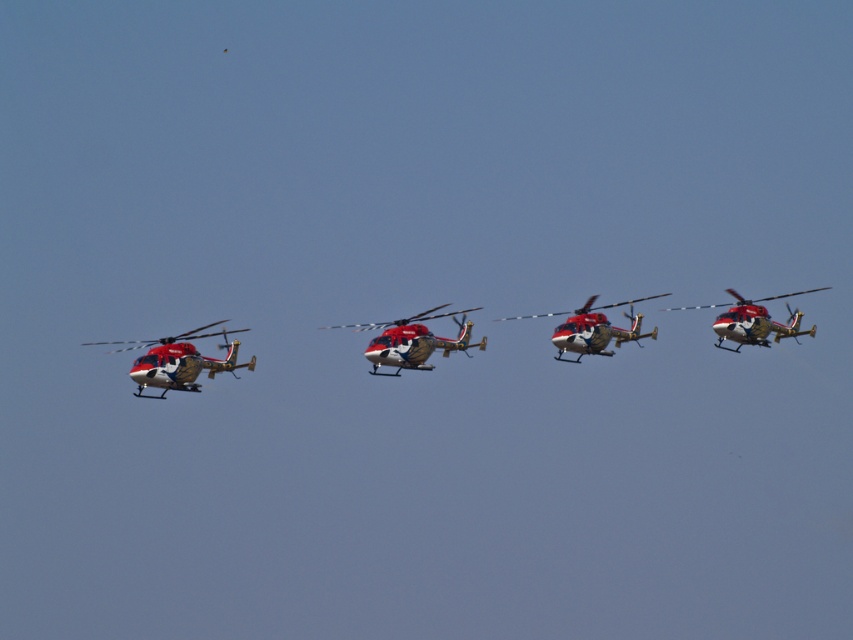
Question: Which point is closer to the camera taking this photo?

Choices:
 (A) (231, 356)
 (B) (828, 288)
 (C) (569, 342)
 (D) (463, 324)

Answer: (A)

Question: Does metallic red helicopter at left come in front of metallic red helicopter at center?

Choices:
 (A) no
 (B) yes

Answer: (B)

Question: Which of these objects is positioned farthest from the metallic red helicopter at left?

Choices:
 (A) metallic gold helicopter at right
 (B) metallic gold helicopter at center
 (C) metallic red helicopter at center

Answer: (A)

Question: Is metallic red helicopter at left positioned behind metallic red helicopter at center?

Choices:
 (A) no
 (B) yes

Answer: (A)

Question: Where is metallic gold helicopter at center located in relation to metallic gold helicopter at right in the image?

Choices:
 (A) left
 (B) right

Answer: (A)

Question: Which of the following is the farthest from the observer?

Choices:
 (A) (772, 321)
 (B) (469, 333)

Answer: (A)